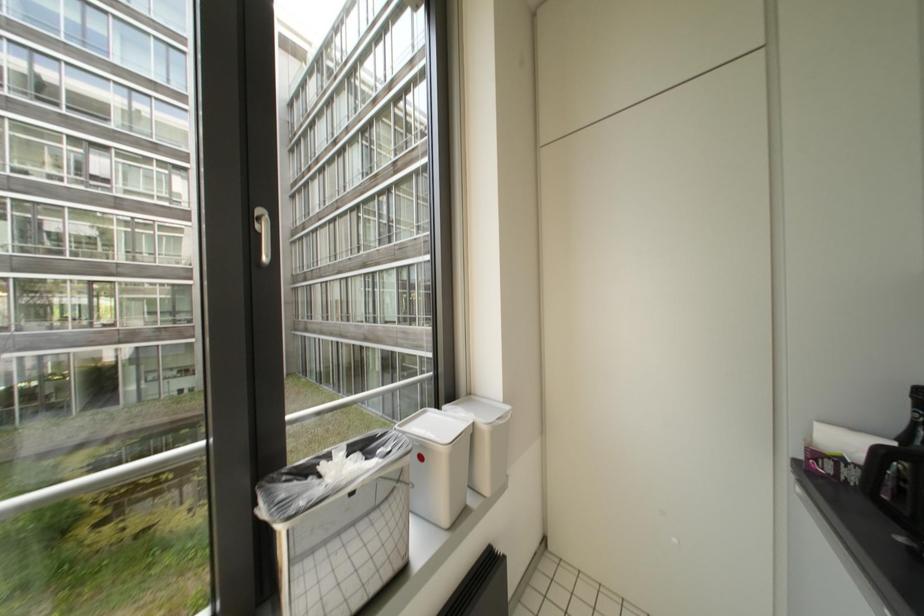
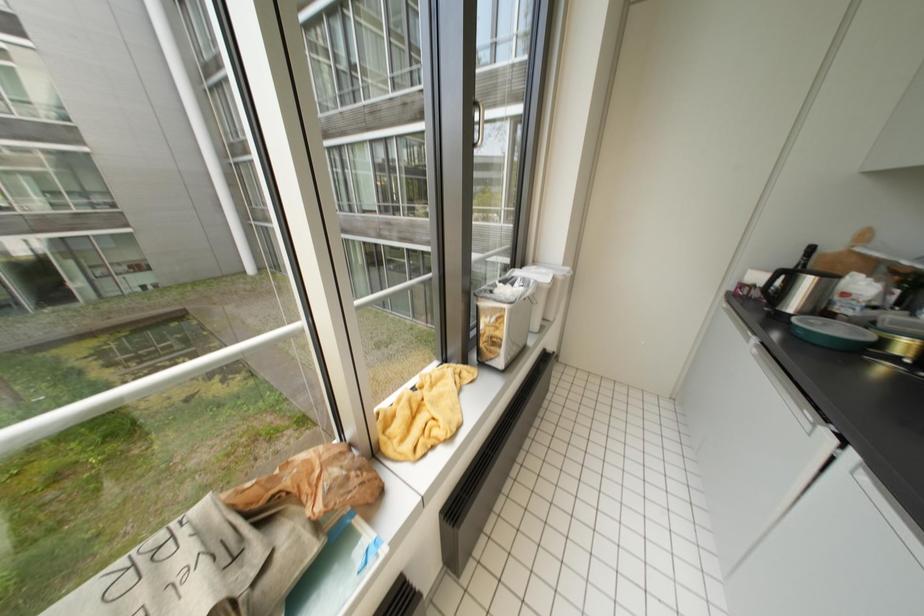
Question: How did the camera likely rotate?

Choices:
 (A) Left
 (B) Right
 (C) Up
 (D) Down

Answer: (D)